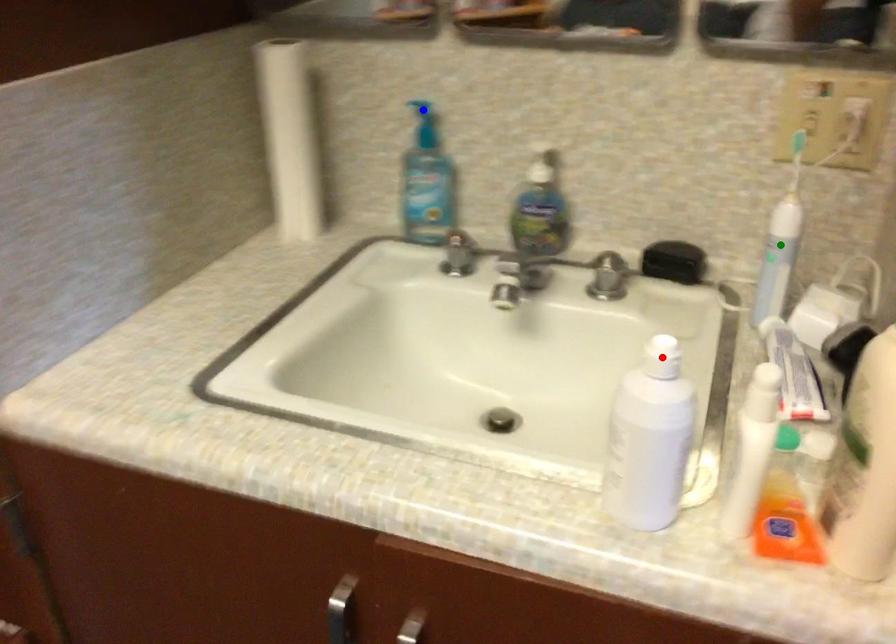
Order these from nearest to farthest:
1. green point
2. red point
3. blue point

red point → green point → blue point